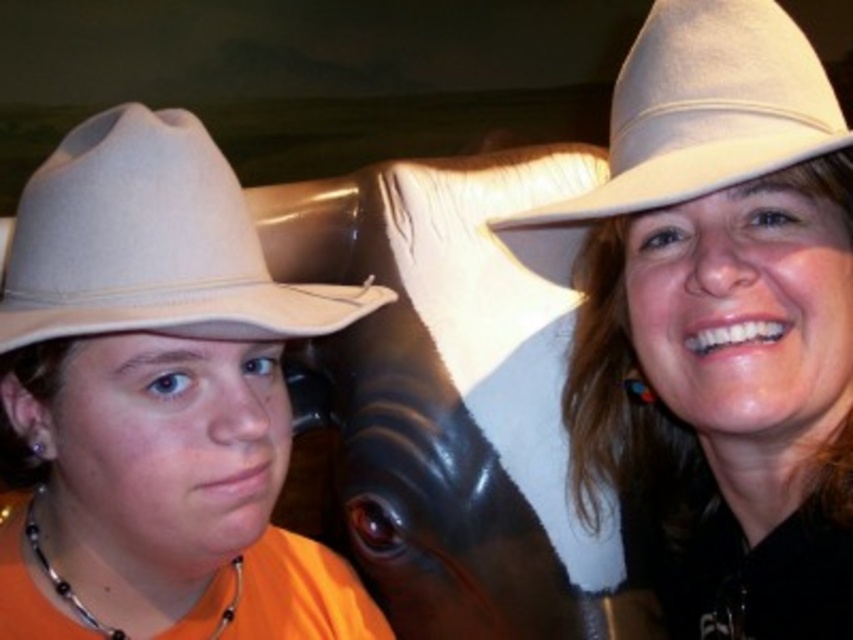
Question: Estimate the real-world distances between objects in this image. Which object is closer to the beige felt cowboy hat at upper right?

Choices:
 (A) white felt cowboy hat at upper center
 (B) matte beige cowboy hat at left
 (C) felt cowboy hat at left

Answer: (A)

Question: Can you confirm if felt cowboy hat at left is positioned below beige felt cowboy hat at upper right?

Choices:
 (A) yes
 (B) no

Answer: (A)

Question: Is white felt cowboy hat at upper center above beige felt cowboy hat at upper right?

Choices:
 (A) yes
 (B) no

Answer: (B)

Question: Which object is positioned farthest from the white felt cowboy hat at upper center?

Choices:
 (A) black beaded necklace at lower left
 (B) felt cowboy hat at left
 (C) matte beige cowboy hat at left

Answer: (A)

Question: Does felt cowboy hat at left have a larger size compared to beige felt cowboy hat at upper right?

Choices:
 (A) yes
 (B) no

Answer: (A)

Question: Among these points, which one is farthest from the camera?

Choices:
 (A) 93,627
 (B) 816,195
 (C) 171,214
 (D) 206,164

Answer: (A)